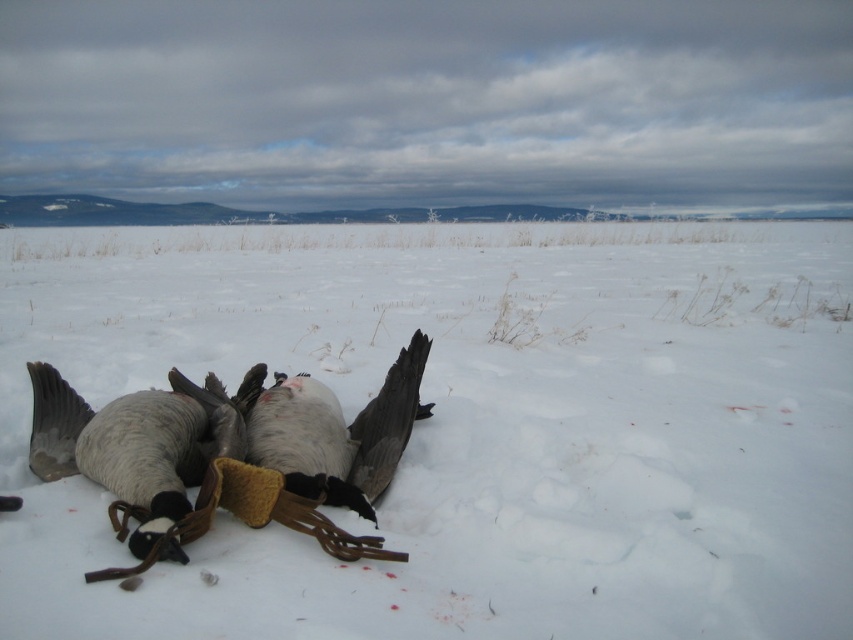
You are a wildlife photographer aiming to capture a closeup of the gray downy goose at center. However, the white fluffy snow at center is blocking your view. Can you move the snow to get a clear shot?

The white fluffy snow at center is in front of the gray downy goose at center, so moving the snow would allow you to see the goose clearly.

You are a wildlife photographer who wants to capture the Canada geese in the snow. You notice a white fluffy snow at center marked by point (466, 426). Where should you position your camera relative to the Canada geese to ensure the white fluffy snow at center is in the background of your photo?

To have the white fluffy snow at center as the background, position your camera behind the Canada geese so that they are in front of the snow marked by point (466, 426).